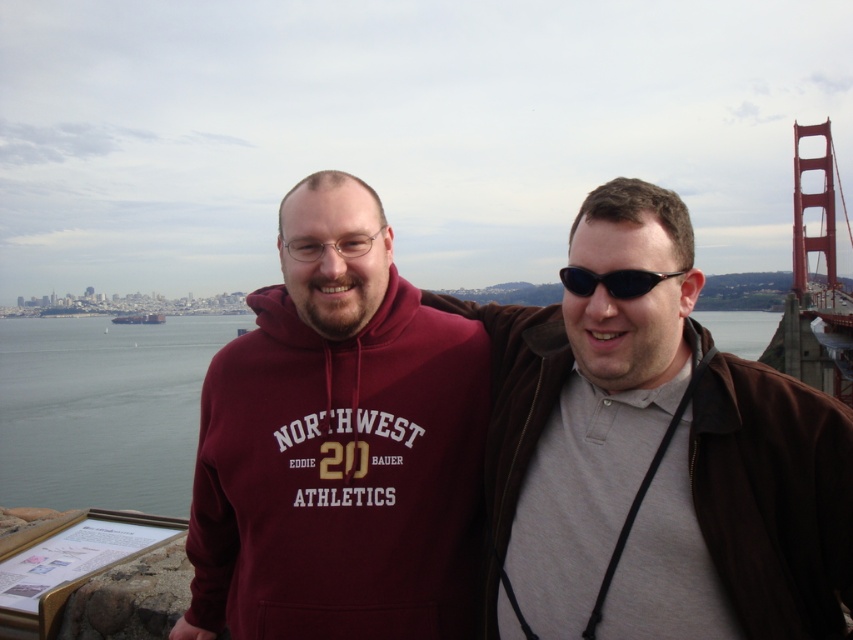
Question: Estimate the real-world distances between objects in this image. Which object is farther from the brown leather jacket at right?

Choices:
 (A) maroon hoodie at center
 (B) black plastic goggles at center

Answer: (A)

Question: Can you confirm if brown leather jacket at right is thinner than maroon hoodie at center?

Choices:
 (A) yes
 (B) no

Answer: (B)

Question: Which point appears farthest from the camera in this image?

Choices:
 (A) (300, 193)
 (B) (631, 278)

Answer: (A)

Question: Can you confirm if brown leather jacket at right is positioned below maroon hoodie at center?

Choices:
 (A) yes
 (B) no

Answer: (A)

Question: Where is brown leather jacket at right located in relation to black plastic goggles at center in the image?

Choices:
 (A) above
 (B) below

Answer: (B)

Question: Among these points, which one is farthest from the camera?

Choices:
 (A) click(x=683, y=480)
 (B) click(x=366, y=289)
 (C) click(x=641, y=275)

Answer: (B)